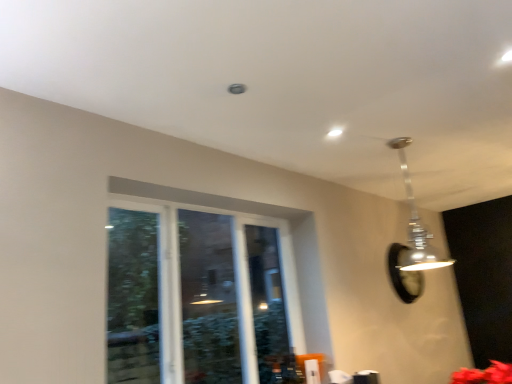
I want to click on clear glass window at center, so click(281, 251).

Which object is positioned more to the left, metallic silver pendant light at upper right or clear glass window at center?

clear glass window at center is more to the left.

Is metallic silver pendant light at upper right oriented towards clear glass window at center?

No.

From the image's perspective, between metallic silver pendant light at upper right and clear glass window at center, which one is located above?

metallic silver pendant light at upper right.

Which of these two, metallic silver pendant light at upper right or clear glass window at center, is smaller?

Smaller between the two is metallic silver pendant light at upper right.

Is black glass mirror at upper right located outside metallic silver pendant light at upper right?

That's correct, black glass mirror at upper right is outside of metallic silver pendant light at upper right.

Can you tell me how much black glass mirror at upper right and metallic silver pendant light at upper right differ in facing direction?

black glass mirror at upper right and metallic silver pendant light at upper right are facing 90.3 degrees away from each other.

Considering their positions, is black glass mirror at upper right located in front of or behind metallic silver pendant light at upper right?

In the image, black glass mirror at upper right appears behind metallic silver pendant light at upper right.

Is black glass mirror at upper right touching metallic silver pendant light at upper right?

No, black glass mirror at upper right is not touching metallic silver pendant light at upper right.

From the picture: Does clear glass window at center lie in front of metallic silver pendant light at upper right?

Yes, clear glass window at center is closer to the camera.

Find the location of `lamp that is on the right side of clear glass window at center`. lamp that is on the right side of clear glass window at center is located at coordinates (415, 223).

Is clear glass window at center not near metallic silver pendant light at upper right?

Yes, clear glass window at center and metallic silver pendant light at upper right are quite far apart.

Is black glass mirror at upper right oriented towards clear glass window at center?

No.

Who is taller, black glass mirror at upper right or clear glass window at center?

clear glass window at center.

Can you confirm if black glass mirror at upper right is wider than clear glass window at center?

In fact, black glass mirror at upper right might be narrower than clear glass window at center.

Where is `mirror below the clear glass window at center (from the image's perspective)`? This screenshot has width=512, height=384. mirror below the clear glass window at center (from the image's perspective) is located at coordinates [x=404, y=275].

From the picture: Does metallic silver pendant light at upper right turn towards black glass mirror at upper right?

No, metallic silver pendant light at upper right does not turn towards black glass mirror at upper right.

From the image's perspective, does metallic silver pendant light at upper right appear lower than black glass mirror at upper right?

No, from the image's perspective, metallic silver pendant light at upper right is not beneath black glass mirror at upper right.

Are metallic silver pendant light at upper right and black glass mirror at upper right beside each other?

metallic silver pendant light at upper right and black glass mirror at upper right are clearly separated.

Between metallic silver pendant light at upper right and black glass mirror at upper right, which one is positioned behind?

black glass mirror at upper right is further away from the camera.

You are a GUI agent. You are given a task and a screenshot of the screen. Output one action in this format:
    pyautogui.click(x=<x>, y=<y>)
    Task: Click on the mirror above the clear glass window at center (from a real-world perspective)
    This screenshot has height=384, width=512.
    Given the screenshot: What is the action you would take?
    pyautogui.click(x=404, y=275)

Are clear glass window at center and black glass mirror at upper right located far from each other?

Yes, clear glass window at center and black glass mirror at upper right are located far from each other.

In the image, is clear glass window at center positioned in front of or behind black glass mirror at upper right?

clear glass window at center is in front of black glass mirror at upper right.

Can you confirm if clear glass window at center is positioned to the left of black glass mirror at upper right?

Yes, clear glass window at center is to the left of black glass mirror at upper right.

The width and height of the screenshot is (512, 384). Find the location of `window lying below the metallic silver pendant light at upper right (from the image's perspective)`. window lying below the metallic silver pendant light at upper right (from the image's perspective) is located at coordinates (281, 251).

At what (x,y) coordinates should I click in order to perform the action: click on lamp in front of the black glass mirror at upper right. Please return your answer as a coordinate pair (x, y). The width and height of the screenshot is (512, 384). Looking at the image, I should click on (415, 223).

Based on their spatial positions, is metallic silver pendant light at upper right or black glass mirror at upper right further from clear glass window at center?

black glass mirror at upper right is positioned further to the anchor clear glass window at center.

Based on the photo, which object lies further to the anchor point black glass mirror at upper right, metallic silver pendant light at upper right or clear glass window at center?

Among the two, clear glass window at center is located further to black glass mirror at upper right.

Estimate the real-world distances between objects in this image. Which object is closer to black glass mirror at upper right, clear glass window at center or metallic silver pendant light at upper right?

metallic silver pendant light at upper right lies closer to black glass mirror at upper right than the other object.

When comparing their distances from metallic silver pendant light at upper right, does clear glass window at center or black glass mirror at upper right seem further?

clear glass window at center lies further to metallic silver pendant light at upper right than the other object.

When comparing their distances from metallic silver pendant light at upper right, does black glass mirror at upper right or clear glass window at center seem further?

The object further to metallic silver pendant light at upper right is clear glass window at center.

From the image, which object appears to be farther from clear glass window at center, black glass mirror at upper right or metallic silver pendant light at upper right?

The object further to clear glass window at center is black glass mirror at upper right.

Identify the location of lamp between clear glass window at center and black glass mirror at upper right from front to back. This screenshot has width=512, height=384. (415, 223).